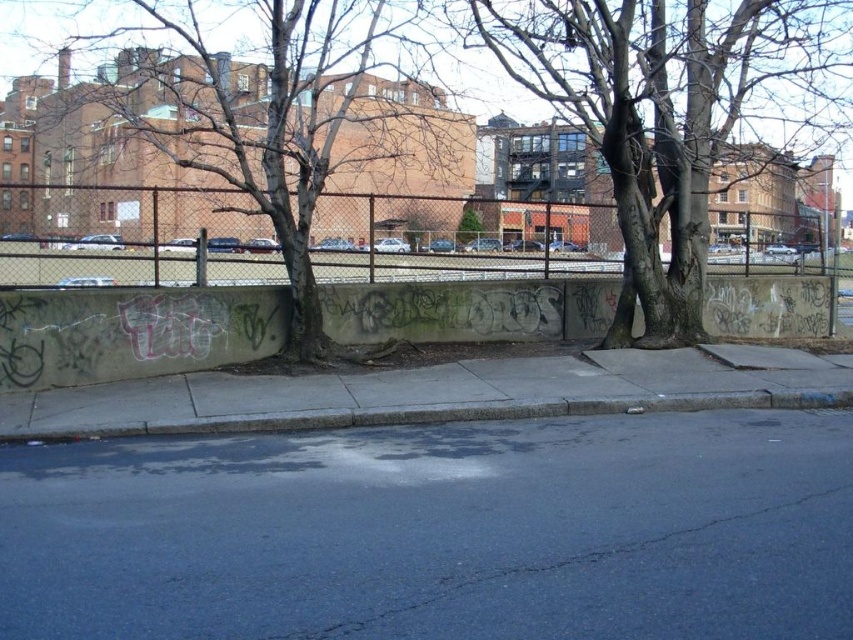
Question: Estimate the real-world distances between objects in this image. Which object is farther from the gray concrete curb at lower center?

Choices:
 (A) metallic chain-link fence at center
 (B) bare wood tree at center

Answer: (B)

Question: Is dark asphalt pavement at lower center below gray concrete curb at lower center?

Choices:
 (A) no
 (B) yes

Answer: (B)

Question: Is bare wood tree at center in front of gray concrete curb at lower center?

Choices:
 (A) no
 (B) yes

Answer: (A)

Question: Estimate the real-world distances between objects in this image. Which object is farther from the metallic chain-link fence at center?

Choices:
 (A) gray bark tree at left
 (B) bare wood tree at center
 (C) dark asphalt pavement at lower center
 (D) gray concrete curb at lower center

Answer: (C)

Question: Which of the following is the closest to the observer?

Choices:
 (A) dark asphalt pavement at lower center
 (B) bare wood tree at center
 (C) metallic chain-link fence at center
 (D) gray concrete curb at lower center

Answer: (A)

Question: Does gray bark tree at left lie in front of metallic chain-link fence at center?

Choices:
 (A) no
 (B) yes

Answer: (B)